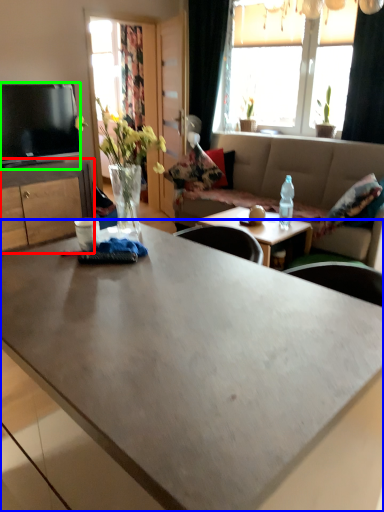
Question: Based on their relative distances, which object is farther from cabinetry (highlighted by a red box)? Choose from coffee table (highlighted by a blue box) and television (highlighted by a green box).

Choices:
 (A) coffee table
 (B) television

Answer: (A)